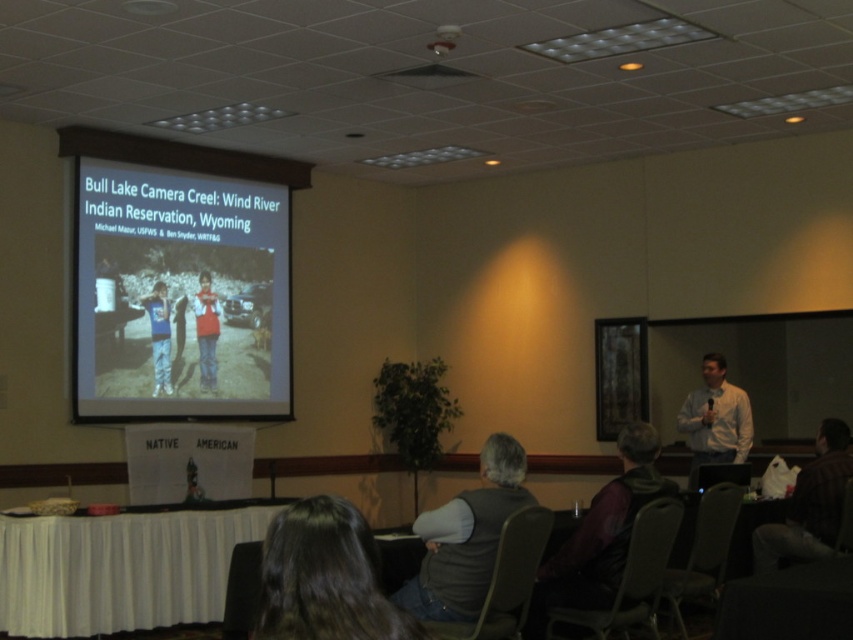
Question: Is gray fabric vest at lower center above red cotton shirt at center?

Choices:
 (A) yes
 (B) no

Answer: (B)

Question: Is dark brown hair at lower center positioned behind red cotton shirt at center?

Choices:
 (A) yes
 (B) no

Answer: (B)

Question: Which of these objects is positioned closest to the dark brown hair at lower center?

Choices:
 (A) brown leather jacket at lower right
 (B) gray fabric vest at lower center

Answer: (B)

Question: Which point is closer to the camera taking this photo?

Choices:
 (A) (157, 360)
 (B) (329, 570)

Answer: (B)

Question: Based on their relative distances, which object is nearer to the gray fabric vest at lower center?

Choices:
 (A) dark brown hair at lower center
 (B) red cotton shirt at center
 (C) matte plastic projector screen at upper left

Answer: (A)

Question: Is white cloth-covered table at lower left bigger than gray fabric jacket at lower right?

Choices:
 (A) yes
 (B) no

Answer: (A)